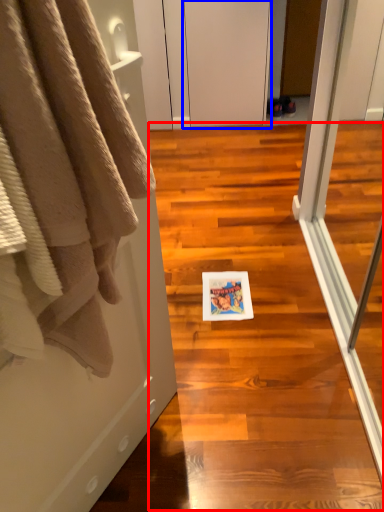
Question: Among these objects, which one is nearest to the camera, stair (highlighted by a red box) or screen door (highlighted by a blue box)?

Choices:
 (A) stair
 (B) screen door

Answer: (A)